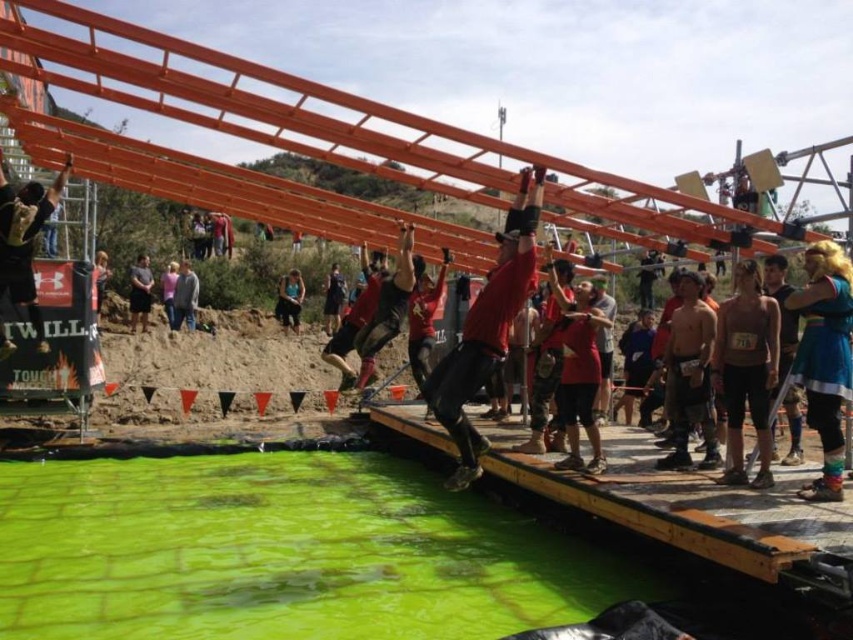
Question: Which of the following is the closest to the observer?

Choices:
 (A) matte black tank top at upper left
 (B) gray cotton shirt at center
 (C) blue fabric shirt at center

Answer: (A)

Question: Which object is the farthest from the gray cotton shirt at center?

Choices:
 (A) light blue fabric shirt at center
 (B) black fabric at center
 (C) teal fabric dress at center

Answer: (C)

Question: Can you confirm if brown fabric tank top at center is positioned to the left of gray cotton shirt at center?

Choices:
 (A) yes
 (B) no

Answer: (B)

Question: Does green algae water at lower center have a larger size compared to blue fabric shirt at center?

Choices:
 (A) yes
 (B) no

Answer: (B)

Question: Which object appears closest to the camera in this image?

Choices:
 (A) green algae water at lower center
 (B) matte black tank top at upper left
 (C) matte black backpack at upper left

Answer: (A)

Question: Is red matte shirt at center smaller than matte black backpack at upper left?

Choices:
 (A) yes
 (B) no

Answer: (A)